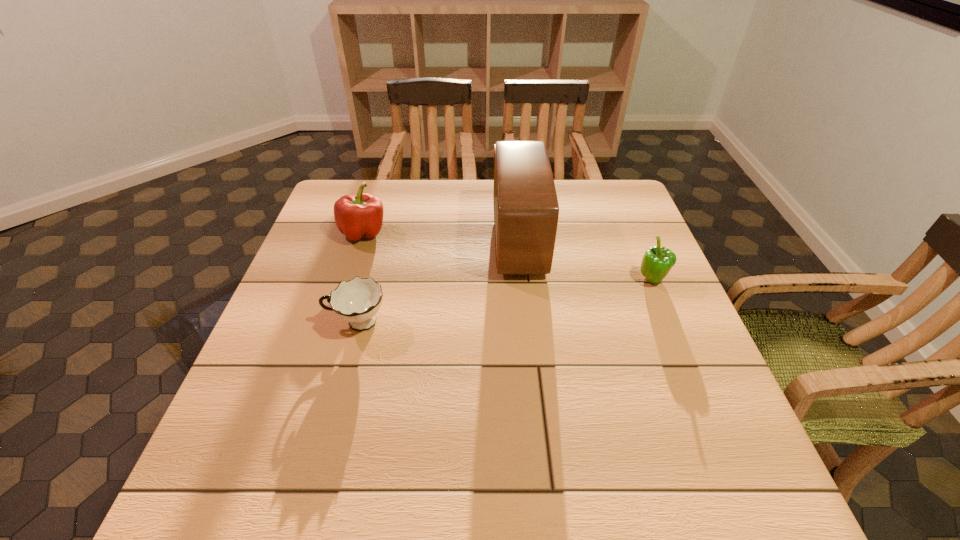
What are the coordinates of `empty location between the farther bell pepper and the tallest object` in the screenshot? It's located at (441, 237).

You are a GUI agent. You are given a task and a screenshot of the screen. Output one action in this format:
    pyautogui.click(x=<x>, y=<y>)
    Task: Click on the free point between the tallest object and the cup
    The height and width of the screenshot is (540, 960).
    Given the screenshot: What is the action you would take?
    pyautogui.click(x=438, y=282)

The image size is (960, 540). Identify the location of vacant space that is in between the right bell pepper and the cup. (505, 301).

This screenshot has width=960, height=540. In order to click on object that can be found as the second closest to the tallest object in this screenshot , I will do `click(357, 301)`.

Locate which object ranks third in proximity to the nearest object. Please provide its 2D coordinates. Your answer should be formatted as a tuple, i.e. [(x, y)], where the tuple contains the x and y coordinates of a point satisfying the conditions above.

[(657, 261)]

Find the location of a particular element. This screenshot has height=540, width=960. vacant point that satisfies the following two spatial constraints: 1. on the front-facing side of the radio receiver; 2. on the right side of the rightmost object is located at coordinates (522, 280).

This screenshot has height=540, width=960. What are the coordinates of `vacant space that satisfies the following two spatial constraints: 1. on the side of the right bell pepper with the handle; 2. on the left side of the cup` in the screenshot? It's located at (369, 280).

This screenshot has width=960, height=540. In order to click on free space that satisfies the following two spatial constraints: 1. on the front-facing side of the nearer bell pepper; 2. on the right side of the tallest object in this screenshot , I will do `click(522, 280)`.

The height and width of the screenshot is (540, 960). I want to click on vacant position in the image that satisfies the following two spatial constraints: 1. on the side of the shortest object with the handle; 2. on the back side of the right bell pepper, so click(x=369, y=280).

The image size is (960, 540). In order to click on free region that satisfies the following two spatial constraints: 1. on the front-facing side of the right bell pepper; 2. on the left side of the radio receiver in this screenshot , I will do `click(522, 280)`.